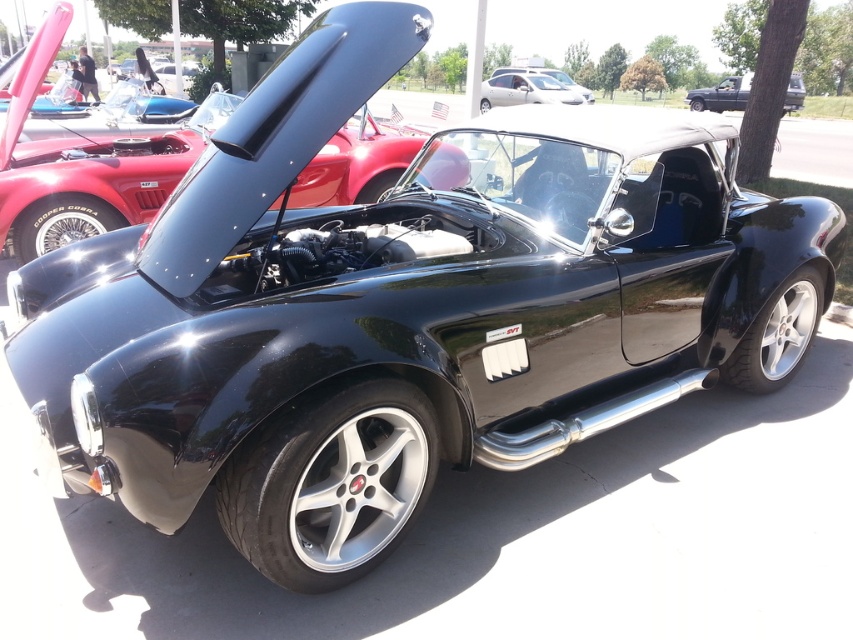
Does point (544, 81) come closer to viewer compared to point (729, 97)?

Yes.

Is satin silver car at upper center closer to camera compared to matte black car at upper right?

That is False.

The height and width of the screenshot is (640, 853). What are the coordinates of `satin silver car at upper center` in the screenshot? It's located at (525, 90).